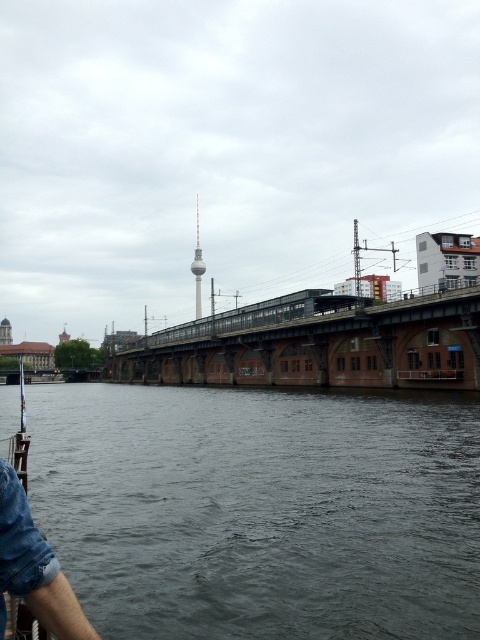
Question: Does dark gray water at lower center appear on the right side of shiny silver tower at center?

Choices:
 (A) yes
 (B) no

Answer: (A)

Question: Which object appears farthest from the camera in this image?

Choices:
 (A) denim shorts at lower left
 (B) dark gray water at lower center

Answer: (B)

Question: Which of the following is the closest to the observer?

Choices:
 (A) (197, 244)
 (B) (261, 508)
 (C) (31, 515)
 (D) (430, 365)

Answer: (C)

Question: Estimate the real-world distances between objects in this image. Which object is closer to the shiny silver tower at center?

Choices:
 (A) denim shorts at lower left
 (B) dark gray water at lower center

Answer: (B)

Question: Can you confirm if brown brick bridge at center is positioned above denim shorts at lower left?

Choices:
 (A) no
 (B) yes

Answer: (B)

Question: Observing the image, what is the correct spatial positioning of denim shorts at lower left in reference to shiny silver tower at center?

Choices:
 (A) below
 (B) above

Answer: (A)